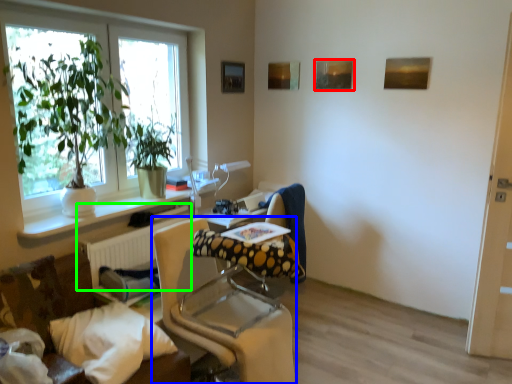
Question: Considering the real-world distances, which object is farthest from picture frame (highlighted by a red box)? chair (highlighted by a blue box) or radiator (highlighted by a green box)?

Choices:
 (A) chair
 (B) radiator

Answer: (A)